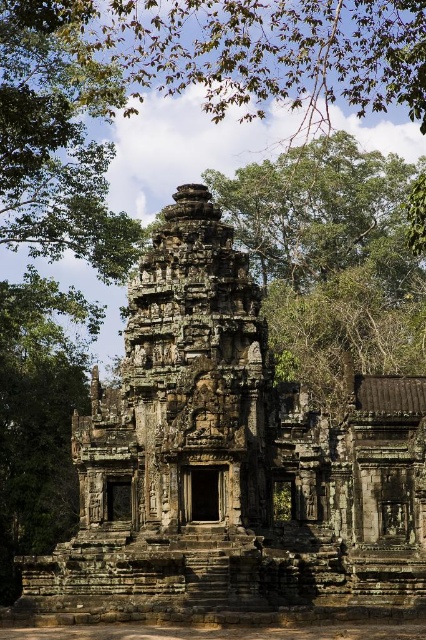
Is gray stone temple at center below green leafy tree at upper left?

Yes.

At what (x,y) coordinates should I click in order to perform the action: click on gray stone temple at center. Please return your answer as a coordinate pair (x, y). The width and height of the screenshot is (426, 640). Looking at the image, I should click on (230, 465).

Is point (155, 477) positioned in front of point (28, 211)?

Yes, it is in front of point (28, 211).

Locate an element on the screen. The height and width of the screenshot is (640, 426). gray stone temple at center is located at coordinates (230, 465).